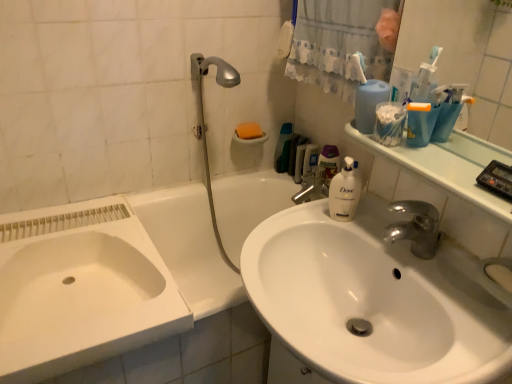
Question: Should I look upward or downward to see white fabric shower curtain at upper center?

Choices:
 (A) down
 (B) up

Answer: (B)

Question: Is silver metallic showerhead at upper center far away from white glossy sink at center?

Choices:
 (A) yes
 (B) no

Answer: (B)

Question: Considering the relative sizes of silver metallic showerhead at upper center and white glossy sink at center in the image provided, is silver metallic showerhead at upper center taller than white glossy sink at center?

Choices:
 (A) yes
 (B) no

Answer: (A)

Question: Is silver metallic showerhead at upper center closer to the viewer compared to white glossy sink at center?

Choices:
 (A) yes
 (B) no

Answer: (B)

Question: Is silver metallic showerhead at upper center shorter than white glossy sink at center?

Choices:
 (A) yes
 (B) no

Answer: (B)

Question: From the image's perspective, is silver metallic showerhead at upper center beneath white glossy sink at center?

Choices:
 (A) yes
 (B) no

Answer: (B)

Question: From the image's perspective, is silver metallic showerhead at upper center located above white glossy sink at center?

Choices:
 (A) no
 (B) yes

Answer: (B)

Question: Is translucent plastic mouthwash at upper right, marked as the second mouthwash in a left-to-right arrangement, thinner than green plastic container at upper center, which appears as the 3th mouthwash when viewed from the right?

Choices:
 (A) yes
 (B) no

Answer: (B)

Question: Is translucent plastic mouthwash at upper right, acting as the second mouthwash starting from the back, outside green plastic container at upper center, the 1th mouthwash viewed from the left?

Choices:
 (A) no
 (B) yes

Answer: (B)

Question: From a real-world perspective, is translucent plastic mouthwash at upper right, acting as the second mouthwash starting from the back, physically above green plastic container at upper center, placed as the 3th mouthwash when sorted from front to back?

Choices:
 (A) no
 (B) yes

Answer: (A)

Question: Is translucent plastic mouthwash at upper right, acting as the second mouthwash starting from the back, aimed at green plastic container at upper center, the first mouthwash positioned from the back?

Choices:
 (A) no
 (B) yes

Answer: (A)

Question: Can you confirm if translucent plastic mouthwash at upper right, the 2th mouthwash viewed from the front, is taller than green plastic container at upper center, which appears as the 3th mouthwash when viewed from the right?

Choices:
 (A) no
 (B) yes

Answer: (A)

Question: Is the position of translucent plastic mouthwash at upper right, acting as the second mouthwash starting from the back, less distant than that of green plastic container at upper center, placed as the 3th mouthwash when sorted from front to back?

Choices:
 (A) no
 (B) yes

Answer: (B)

Question: Is white glossy sink at center not inside white fabric shower curtain at upper center?

Choices:
 (A) yes
 (B) no

Answer: (A)